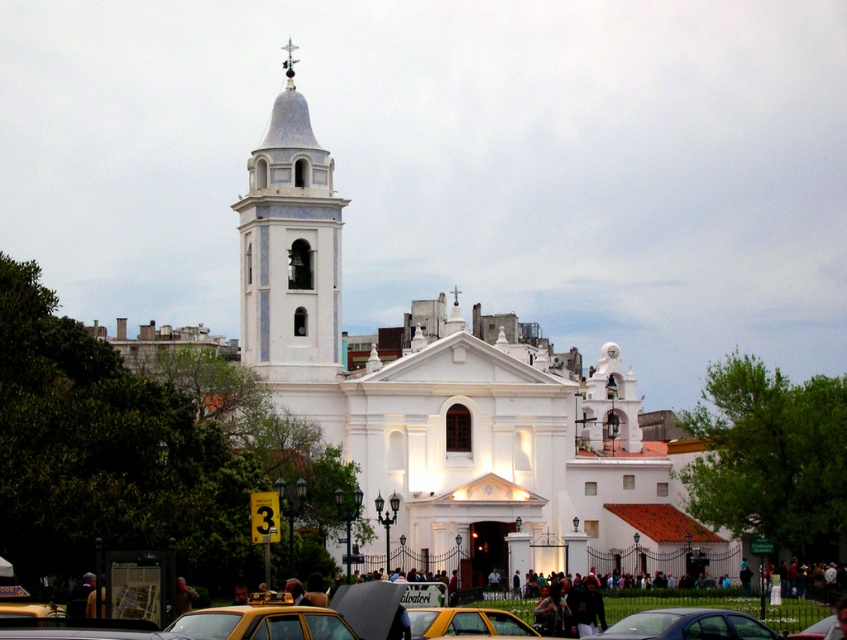
You are a delivery driver who needs to park your vehicle next to the yellow rubber taxi at lower center and the yellow metallic car at center. Which vehicle should you park closer to if you want to maximize the space between your car and the other vehicles?

You should park closer to the yellow metallic car at center because it has a smaller width than the yellow rubber taxi at lower center, allowing more space between your vehicle and the other cars.

You are a photographer trying to capture the white smooth church at center and the yellow matte taxi at lower center in a single shot. Given that the church is larger, which object should you focus on first to ensure both are in the frame?

The white smooth church at center is bigger than the yellow matte taxi at lower center, so you should focus on the white smooth church at center first to ensure it fits within the frame while still capturing the smaller taxi.